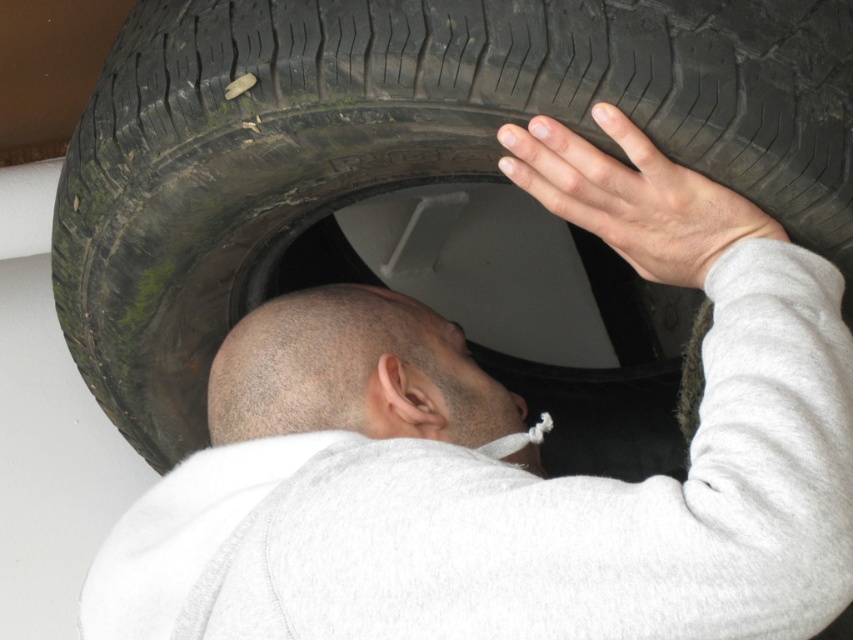
Between point (775, 216) and point (547, 182), which one is positioned behind?

The point (547, 182) is behind.

Is point (395, 17) positioned in front of point (664, 180)?

No, it is behind (664, 180).

Image resolution: width=853 pixels, height=640 pixels. Describe the element at coordinates (395, 148) in the screenshot. I see `black rubber tire at upper center` at that location.

You are a GUI agent. You are given a task and a screenshot of the screen. Output one action in this format:
    pyautogui.click(x=<x>, y=<y>)
    Task: Click on the black rubber tire at upper center
    
    Given the screenshot: What is the action you would take?
    pyautogui.click(x=395, y=148)

Between bald head at center and smooth skin hand at upper right, which one has more height?

bald head at center is taller.

Can you confirm if bald head at center is taller than smooth skin hand at upper right?

Yes, bald head at center is taller than smooth skin hand at upper right.

Which is in front, point (503, 404) or point (712, 259)?

Point (712, 259) is more forward.

Locate an element on the screen. Image resolution: width=853 pixels, height=640 pixels. bald head at center is located at coordinates (352, 372).

Describe the element at coordinates (395, 148) in the screenshot. I see `black rubber tire at upper center` at that location.

Does black rubber tire at upper center appear on the left side of bald head at center?

In fact, black rubber tire at upper center is to the right of bald head at center.

Which is in front, point (239, 192) or point (410, 356)?

Point (239, 192) is in front.

The image size is (853, 640). What are the coordinates of `black rubber tire at upper center` in the screenshot? It's located at (395, 148).